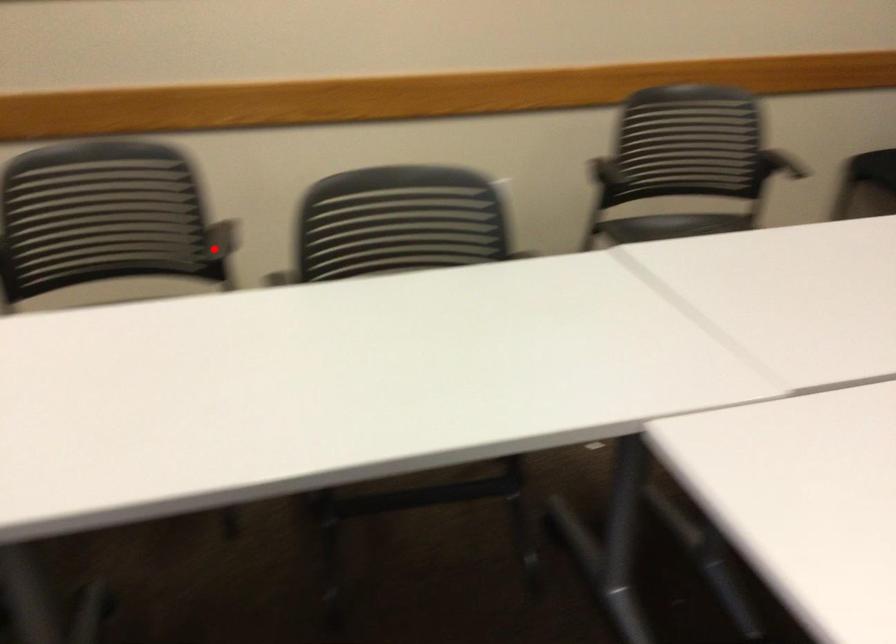
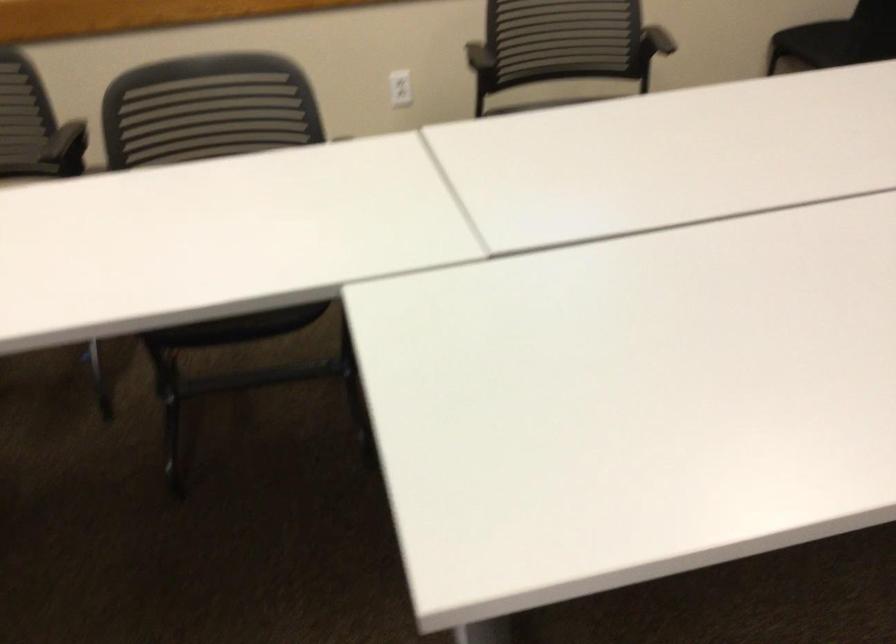
The point at the highlighted location is marked in the first image. Where is the corresponding point in the second image?

(67, 149)